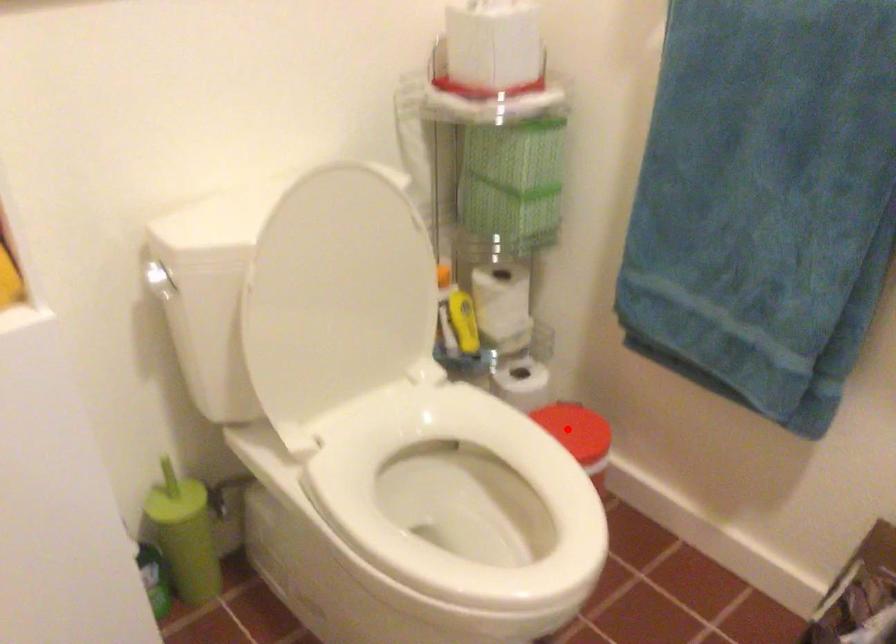
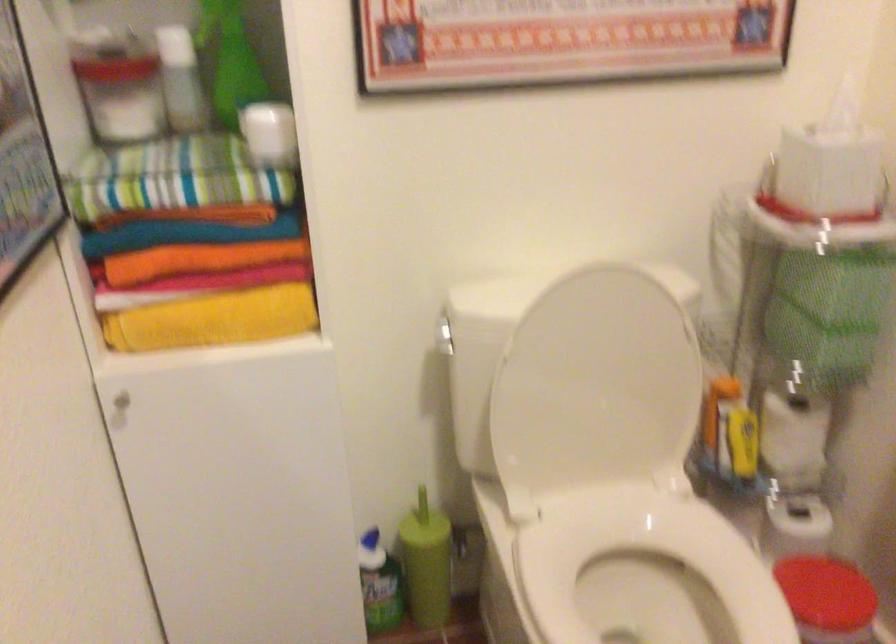
Question: I am providing you with two images of the same scene from different viewpoints. In image1, a red point is highlighted. Considering the same 3D point in image2, which of the following is correct?

Choices:
 (A) It is closer
 (B) It is farther

Answer: (A)